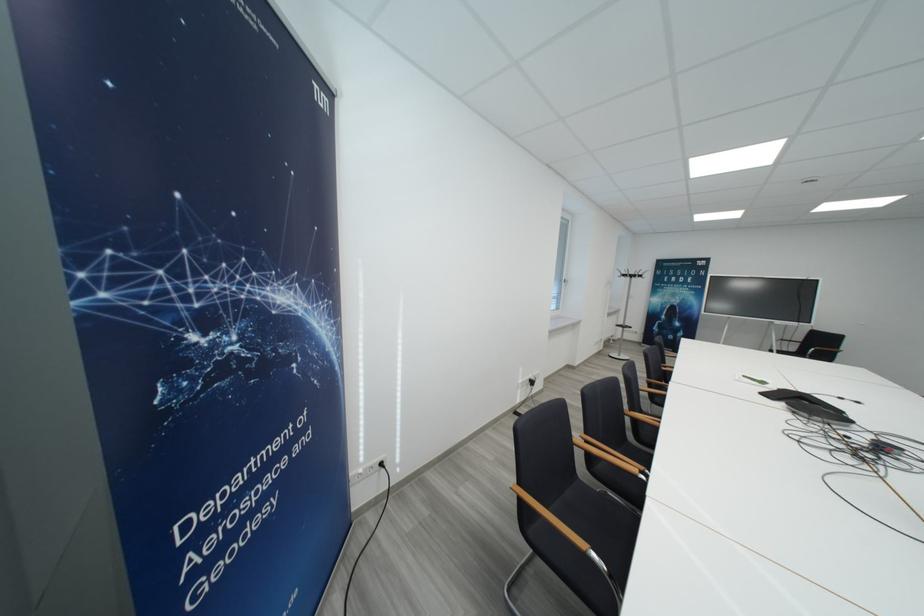
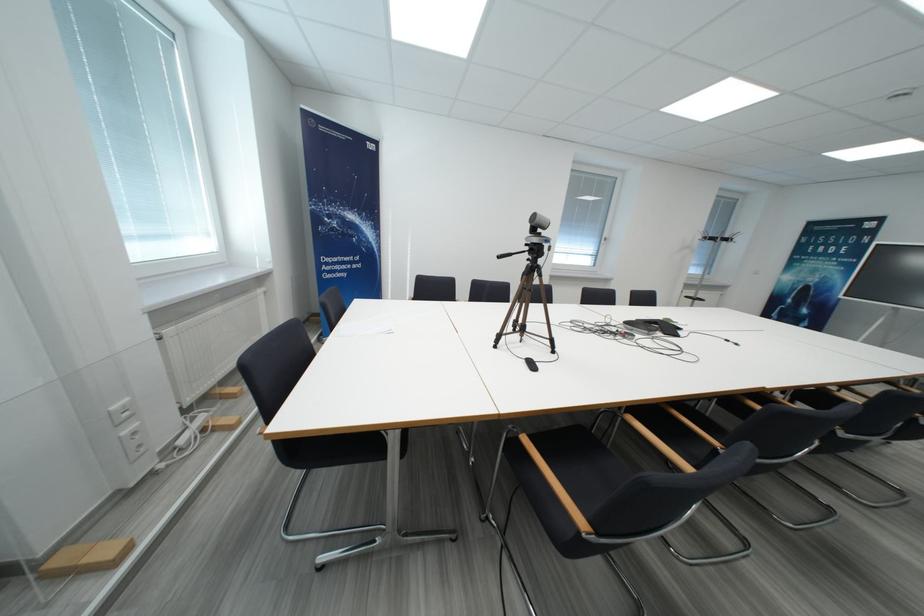
Question: I am providing you with two images of the same scene from different viewpoints. Please identify which objects are invisible in image2.

Choices:
 (A) conference phone
 (B) stuffed panda toy
 (C) black chair sitting surface
 (D) tripod handle

Answer: (C)